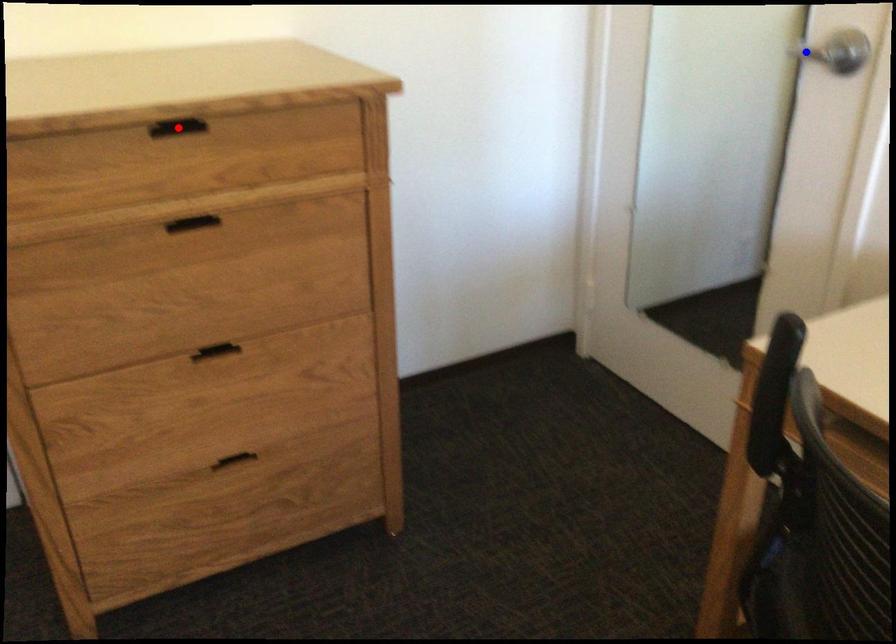
Question: Two points are marked on the image. Which point is closer to the camera?

Choices:
 (A) Blue point is closer.
 (B) Red point is closer.

Answer: (B)